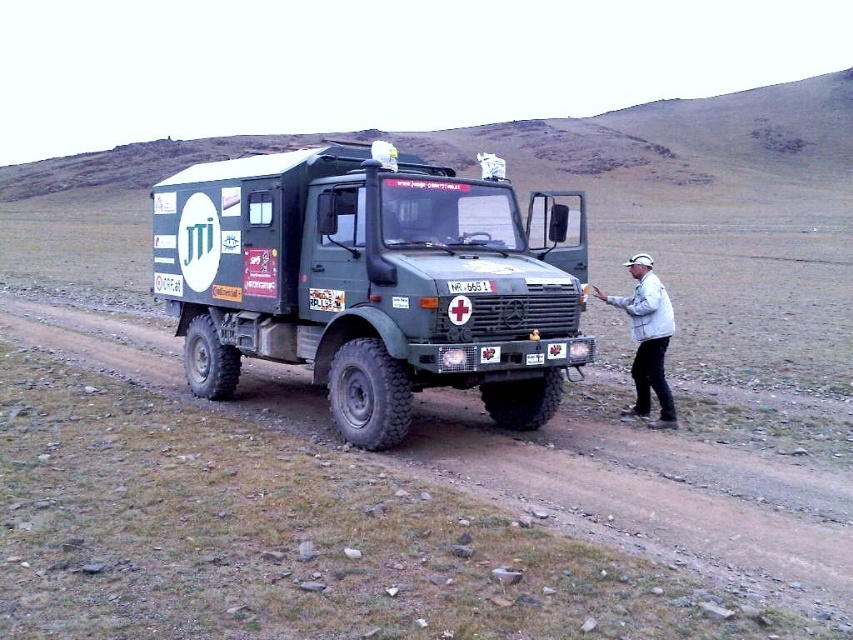
Question: Which object is closer to the camera taking this photo?

Choices:
 (A) green matte truck at center
 (B) brown dirt track at center
 (C) white matte jacket at right
 (D) white plastic license plate at center

Answer: (B)

Question: Which object appears farthest from the camera in this image?

Choices:
 (A) brown dirt track at center
 (B) white matte jacket at right
 (C) green matte truck at center
 (D) white plastic license plate at center

Answer: (D)

Question: Which object is positioned closest to the white plastic license plate at center?

Choices:
 (A) brown dirt track at center
 (B) green matte truck at center
 (C) white matte jacket at right

Answer: (B)

Question: Is green matte truck at center positioned behind brown dirt track at center?

Choices:
 (A) yes
 (B) no

Answer: (A)

Question: Does green matte truck at center have a lesser width compared to white matte jacket at right?

Choices:
 (A) yes
 (B) no

Answer: (B)

Question: Does brown dirt track at center come in front of white matte jacket at right?

Choices:
 (A) yes
 (B) no

Answer: (A)